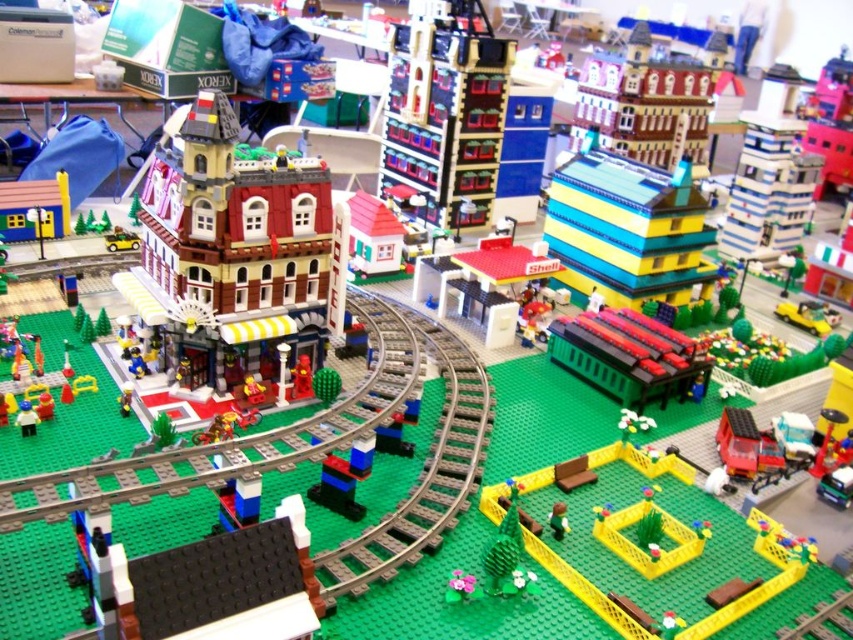
Question: Does brick-patterned building at center lie behind green plastic train at center-right?

Choices:
 (A) no
 (B) yes

Answer: (B)

Question: Which point is closer to the camera?

Choices:
 (A) matte brown building at upper center
 (B) yellow matte building at center

Answer: (B)

Question: Which object is the closest to the yellow plastic fence at lower center?

Choices:
 (A) yellow plastic maze at center
 (B) brick-patterned building at center

Answer: (A)

Question: Considering the real-world distances, which object is farthest from the brick-patterned building at center?

Choices:
 (A) yellow plastic fence at lower center
 (B) brown matte building at center-left
 (C) shiny red train at lower right

Answer: (A)

Question: Is brown matte building at center-left wider than brick-patterned gas station at center?

Choices:
 (A) no
 (B) yes

Answer: (B)

Question: Can you confirm if yellow plastic maze at center is positioned above green plastic train at center-right?

Choices:
 (A) yes
 (B) no

Answer: (B)